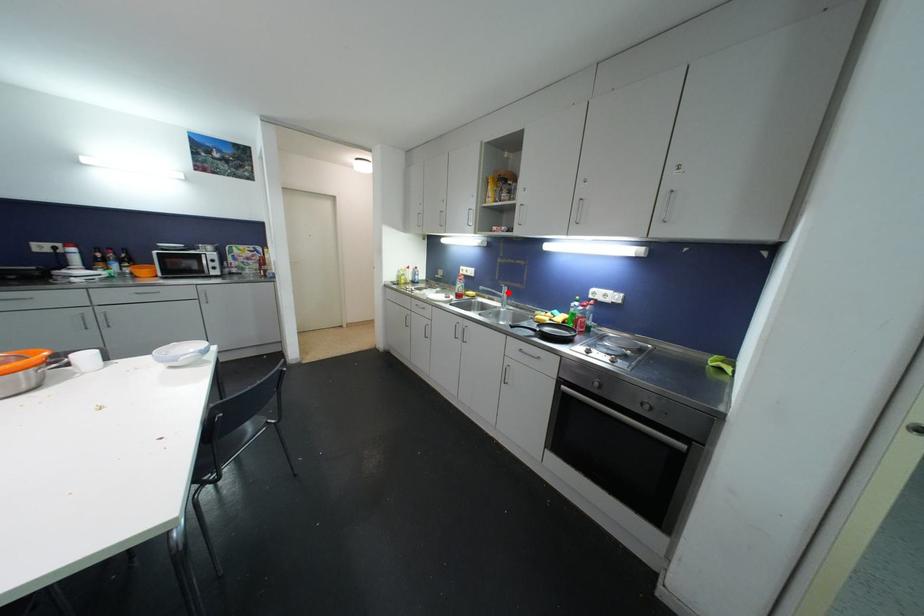
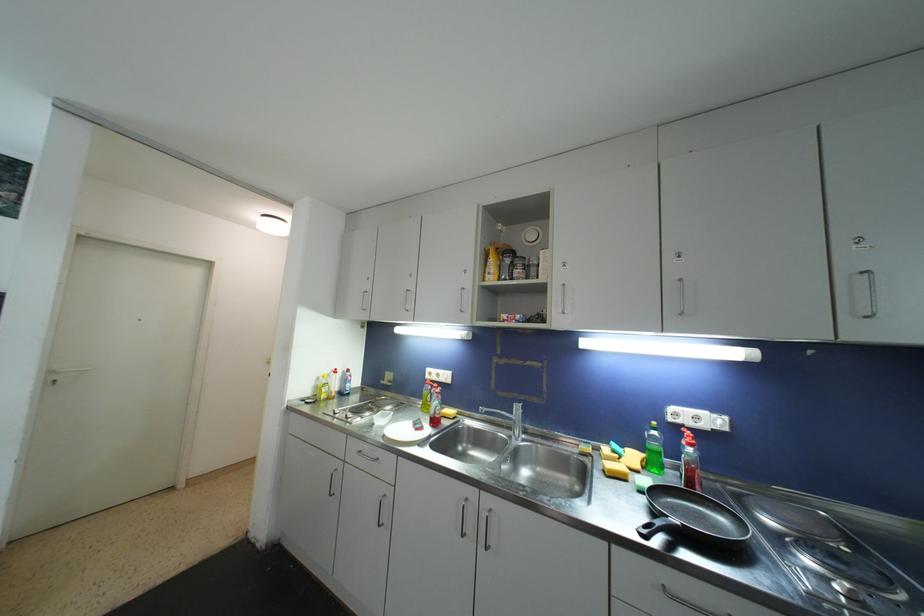
Question: I am providing you with two images of the same scene from different viewpoints. A red point is marked on the first image. Is the red point's position out of view in image 2?

Choices:
 (A) Yes
 (B) No

Answer: (B)